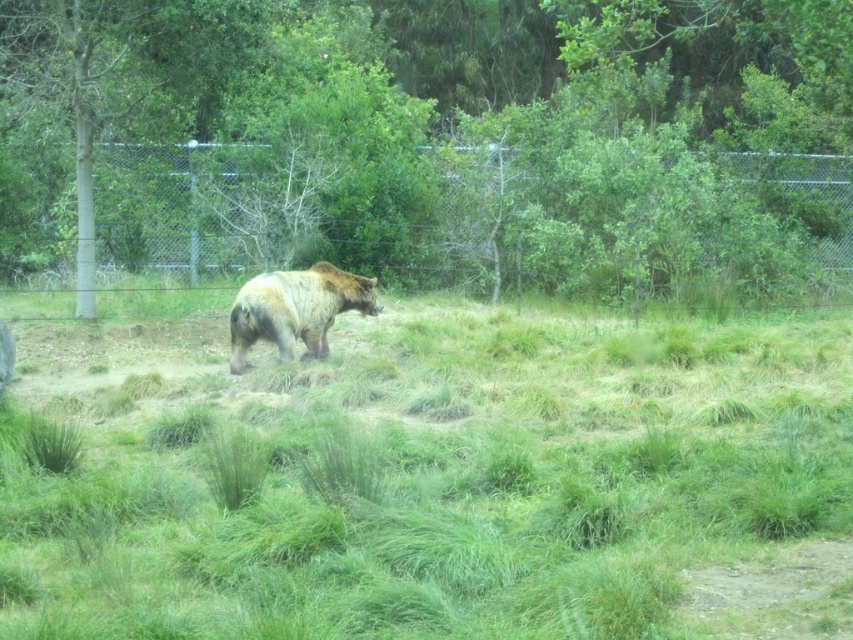
Based on the photo, you are a zookeeper planning to place a feeding station for the bear. The feeding station requires a clear space of at least 3 meters in front of it to ensure the bear can approach safely. Given the bear is currently moving from left to right across the enclosure, and the brown textured tree at center is located at point 0.222, 0.504, where should you position the feeding station to avoid the tree and the bear? Please provide coordinates within the image frame.

The brown textured tree at center is located at point (x=428, y=141). To avoid the tree and the bear moving from left to right, position the feeding station on the right side of the image frame, ensuring it is at least 3 meters away from the tree and the bear. The coordinates should be calculated based on the image dimensions, but a safe position might be around (x=426, y=448) to provide sufficient clearance.